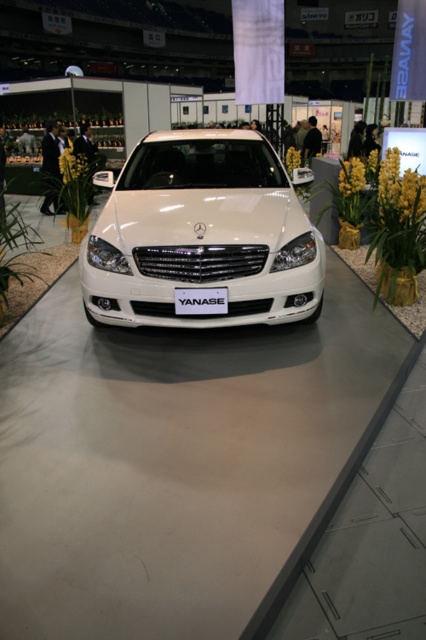
You are a photographer at the auto show and want to capture the white plastic license plate at center without the yellow textured plant at center right appearing in the frame. Is this possible based on their positions?

The yellow textured plant at center right is located above the white plastic license plate at center, so if you position the camera to focus directly on the license plate and angle it slightly downward, the plant should not be in the frame.

You are standing at the entrance of the auto show and want to take a photo of the Mercedes car. There are two points marked in the image. The first point is at coordinate point (2, 196) and the second point is at coordinate point (175, 308). Which point is closer to the camera?

Point (175, 308) is closer to the camera because the description states that point (2, 196) is behind point (175, 308).

You are a photographer standing at the back of the exhibition hall. You want to take a photo of the white plastic license plate at center without the green leafy plant at left blocking the view. Can you move closer to the platform to ensure the license plate is visible? Please explain your reasoning based on their distance apart.

The green leafy plant at left and white plastic license plate at center are 2.45 meters apart. Moving closer to the platform would reduce the distance between you and the license plate, potentially allowing you to position yourself where the 2.45 meters between the plant and license plate ensures the plant doesn